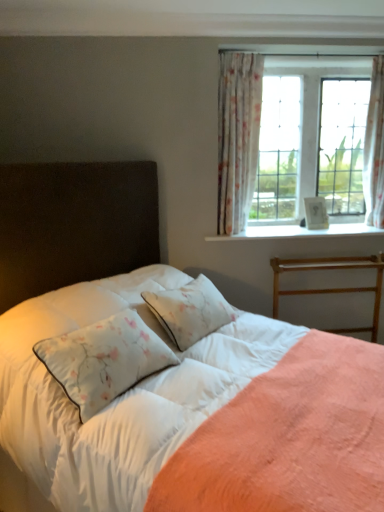
Locate an element on the screen. The height and width of the screenshot is (512, 384). vacant space situated above floral sheer curtain at upper right, which appears as the first curtain when viewed from the left (from a real-world perspective) is located at coordinates (249, 51).